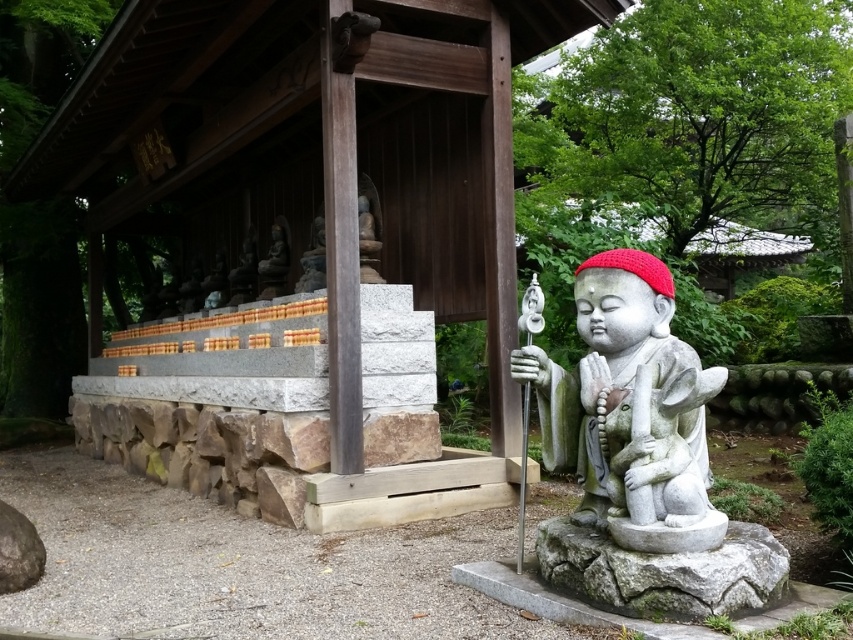
Is point (643, 252) closer to viewer compared to point (761, 573)?

No, (643, 252) is behind (761, 573).

Is point (674, 497) farther from viewer compared to point (735, 589)?

That is True.

Where is `white stone statue at center`? white stone statue at center is located at coordinates (624, 396).